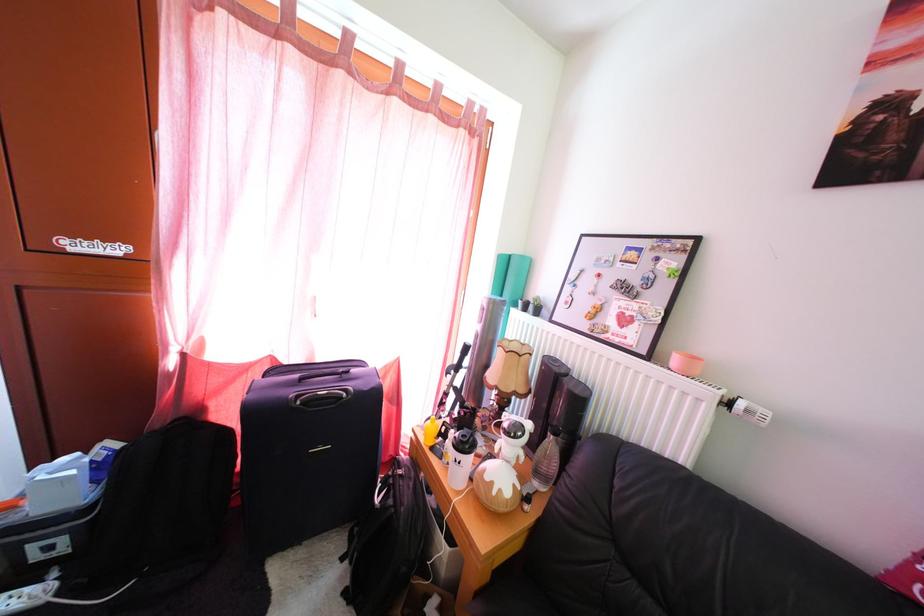
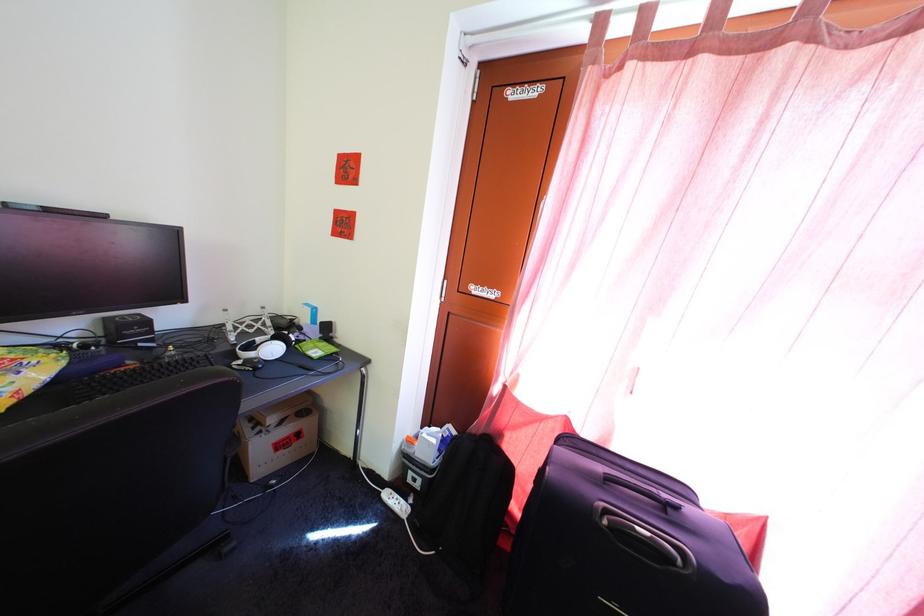
Question: The first image is from the beginning of the video and the second image is from the end. How did the camera likely rotate when shooting the video?

Choices:
 (A) Left
 (B) Right
 (C) Up
 (D) Down

Answer: (A)